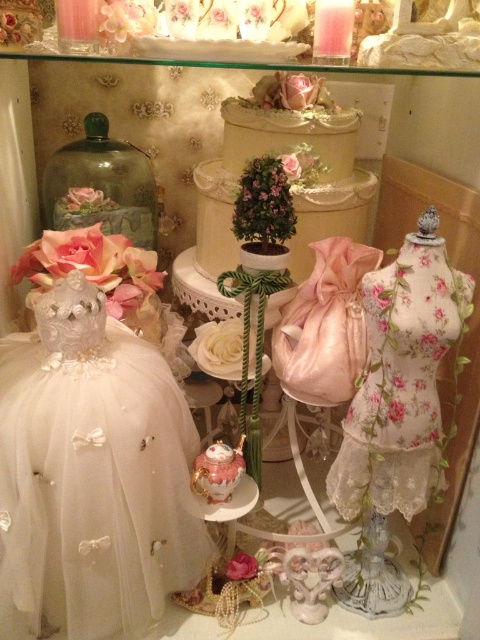
You are a tailor trying to fit a new dress into a display case. The display case has a width of 1.2 meters. You have the white tulle dress at left and the floral lace dress at center. Which dress can fit better in the display case based on their widths?

The white tulle dress at left might be wider than the floral lace dress at center, so the floral lace dress at center is more likely to fit better in the 1.2 meter wide display case.

You are a decorator trying to adjust the placement of the objects in the scene. The point at (x=45, y=577) is part of the floral fabric on the mannequin. If you want to move the floral fabric on the mannequin closer to the white tulle dress by 10 inches, how far apart would they be then?

The current distance between the point at (x=45, y=577) and the white tulle dress is 27.72 inches. If you move the floral fabric on the mannequin closer by 10 inches, the new distance would be 27.72 minus 10, which equals 17.72 inches apart.

You are a customer in a boutique and see the white tulle dress at left and the floral lace dress at center. Which dress is positioned more to the right side of the display?

The floral lace dress at center is positioned more to the right side of the display compared to the white tulle dress at left.